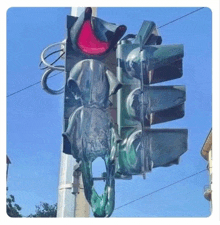
Locate an element on the screen. The width and height of the screenshot is (220, 225). melted lights is located at coordinates (88, 82), (89, 127).